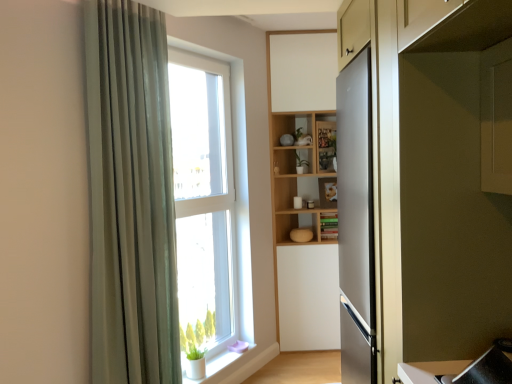
Question: Is green matte plant at center situated inside satin silver refrigerator at right or outside?

Choices:
 (A) inside
 (B) outside

Answer: (B)

Question: Does point (306, 162) appear closer or farther from the camera than point (452, 72)?

Choices:
 (A) farther
 (B) closer

Answer: (A)

Question: Which of these objects is positioned farthest from the green matte cabinet at center?

Choices:
 (A) green matte plant at center
 (B) satin silver refrigerator at right
 (C) white matte window sill at lower left
 (D) clear glass window at center
 (E) green fabric curtain at left

Answer: (B)

Question: Which of these objects is positioned farthest from the green matte plant at center?

Choices:
 (A) clear glass window at center
 (B) white matte window sill at lower left
 (C) satin silver refrigerator at right
 (D) green fabric curtain at left
 (E) green matte cabinet at center

Answer: (C)